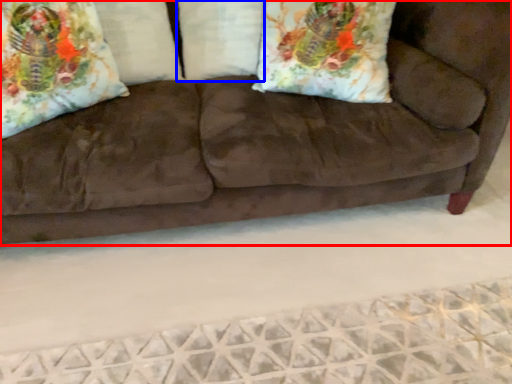
Question: Which object appears farthest to the camera in this image, studio couch (highlighted by a red box) or pillow (highlighted by a blue box)?

Choices:
 (A) studio couch
 (B) pillow

Answer: (B)